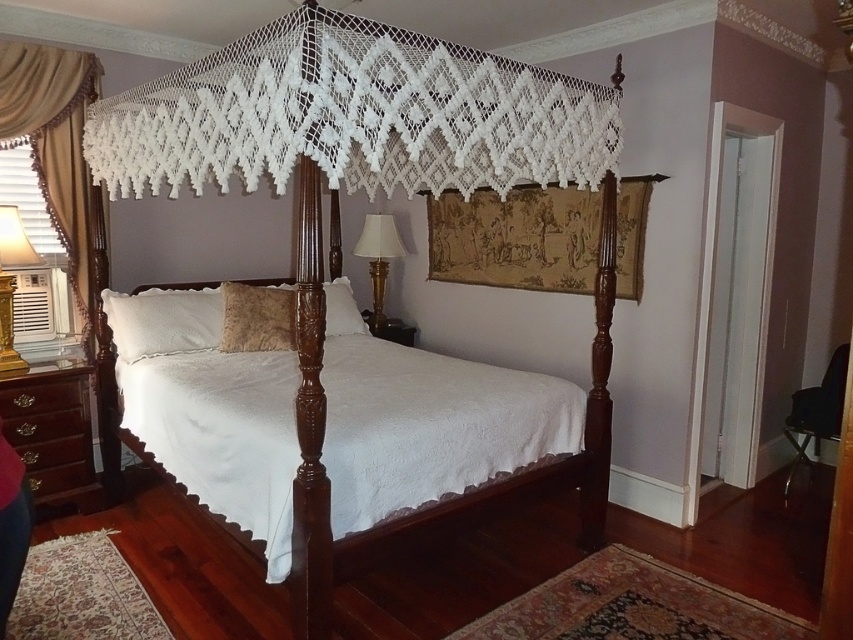
Question: Is the position of white cotton bedspread at center less distant than that of beige satin curtain at left?

Choices:
 (A) no
 (B) yes

Answer: (B)

Question: Estimate the real-world distances between objects in this image. Which object is farther from the beige textured pillow at center?

Choices:
 (A) white soft pillow at center
 (B) wooden lampshade at right
 (C) white fluffy pillow at center
 (D) brown wood dresser at lower left

Answer: (B)

Question: Estimate the real-world distances between objects in this image. Which object is farther from the beige textured pillow at center?

Choices:
 (A) wooden lampshade at right
 (B) white fluffy pillow at center
 (C) white soft pillow at center
 (D) beige satin curtain at left

Answer: (D)

Question: Which point is closer to the camera?

Choices:
 (A) wooden lampshade at right
 (B) polished dark wood bed at center
 (C) beige textured pillow at center

Answer: (B)

Question: From the image, what is the correct spatial relationship of white cotton bedspread at center in relation to wooden lampshade at right?

Choices:
 (A) left
 (B) right

Answer: (A)

Question: Is white fluffy pillow at center wider than white soft pillow at center?

Choices:
 (A) yes
 (B) no

Answer: (B)